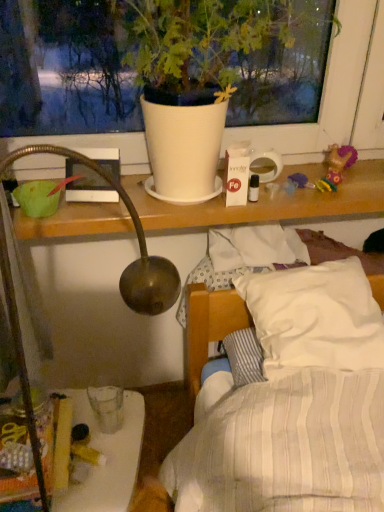
Question: Considering the relative sizes of white matte pot at upper center and translucent plastic glass at lower left in the image provided, is white matte pot at upper center taller than translucent plastic glass at lower left?

Choices:
 (A) no
 (B) yes

Answer: (B)

Question: Is white matte pot at upper center positioned beyond the bounds of translucent plastic glass at lower left?

Choices:
 (A) yes
 (B) no

Answer: (A)

Question: Is white matte pot at upper center wider than translucent plastic glass at lower left?

Choices:
 (A) yes
 (B) no

Answer: (A)

Question: Does white matte pot at upper center turn towards translucent plastic glass at lower left?

Choices:
 (A) yes
 (B) no

Answer: (B)

Question: Does white matte pot at upper center have a larger size compared to translucent plastic glass at lower left?

Choices:
 (A) yes
 (B) no

Answer: (A)

Question: Is white matte pot at upper center next to translucent plastic glass at lower left and touching it?

Choices:
 (A) no
 (B) yes

Answer: (A)

Question: Does plush purple doll at upper right have a greater width compared to white matte pot at upper center?

Choices:
 (A) no
 (B) yes

Answer: (A)

Question: Can you confirm if plush purple doll at upper right is positioned to the left of white matte pot at upper center?

Choices:
 (A) yes
 (B) no

Answer: (B)

Question: Does plush purple doll at upper right have a lesser height compared to white matte pot at upper center?

Choices:
 (A) no
 (B) yes

Answer: (B)

Question: Considering the relative sizes of plush purple doll at upper right and white matte pot at upper center in the image provided, is plush purple doll at upper right thinner than white matte pot at upper center?

Choices:
 (A) yes
 (B) no

Answer: (A)

Question: Can you confirm if plush purple doll at upper right is taller than white matte pot at upper center?

Choices:
 (A) no
 (B) yes

Answer: (A)

Question: From the image's perspective, is plush purple doll at upper right below white matte pot at upper center?

Choices:
 (A) yes
 (B) no

Answer: (A)

Question: Is translucent plastic glass at lower left taller than plush purple doll at upper right?

Choices:
 (A) yes
 (B) no

Answer: (A)